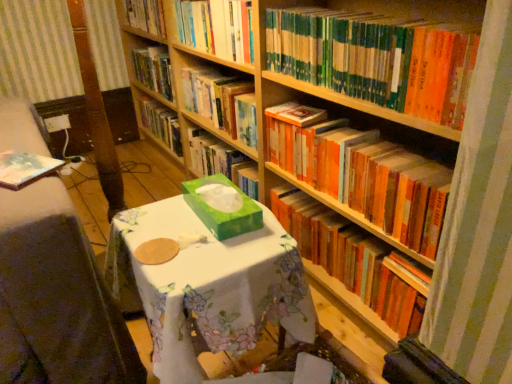
Where is `free spot above green floral tablecloth at center (from a real-world perspective)`? The width and height of the screenshot is (512, 384). free spot above green floral tablecloth at center (from a real-world perspective) is located at coordinates (192, 234).